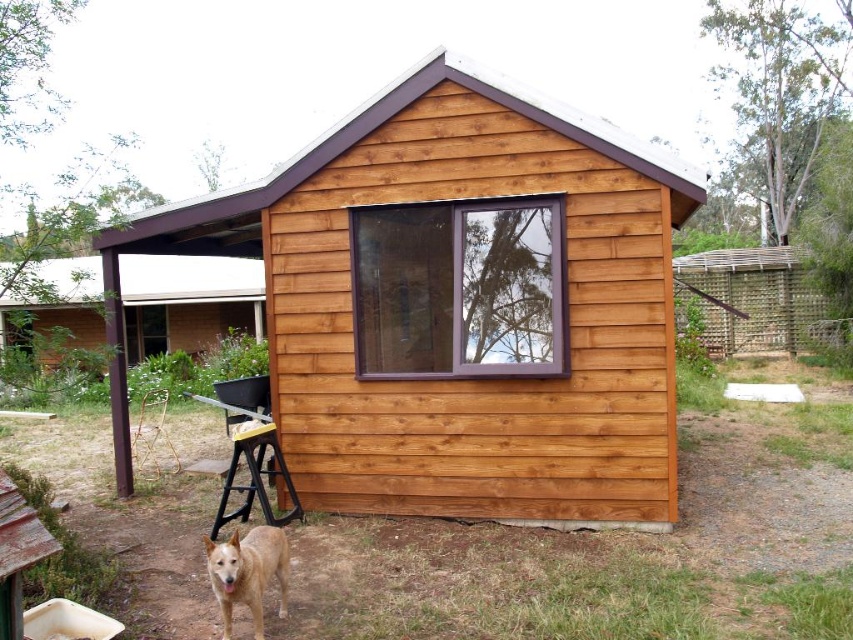
Is point (561, 205) more distant than point (236, 452)?

That is False.

Can you confirm if natural wood cabin at center is positioned to the left of yellow plastic stool at lower center?

Incorrect, natural wood cabin at center is not on the left side of yellow plastic stool at lower center.

Describe the element at coordinates (461, 305) in the screenshot. I see `natural wood cabin at center` at that location.

Locate an element on the screen. natural wood cabin at center is located at coordinates (461, 305).

Who is taller, golden fur dog at lower left or yellow plastic stool at lower center?

With more height is yellow plastic stool at lower center.

Is golden fur dog at lower left above yellow plastic stool at lower center?

Actually, golden fur dog at lower left is below yellow plastic stool at lower center.

Which is behind, point (225, 586) or point (236, 486)?

The point (236, 486) is more distant.

Where is `golden fur dog at lower left`? This screenshot has height=640, width=853. golden fur dog at lower left is located at coordinates (247, 572).

Does natural wood cabin at center have a lesser width compared to golden fur dog at lower left?

No, natural wood cabin at center is not thinner than golden fur dog at lower left.

Does natural wood cabin at center have a greater width compared to golden fur dog at lower left?

Yes, natural wood cabin at center is wider than golden fur dog at lower left.

At what (x,y) coordinates should I click in order to perform the action: click on natural wood cabin at center. Please return your answer as a coordinate pair (x, y). Looking at the image, I should click on (461, 305).